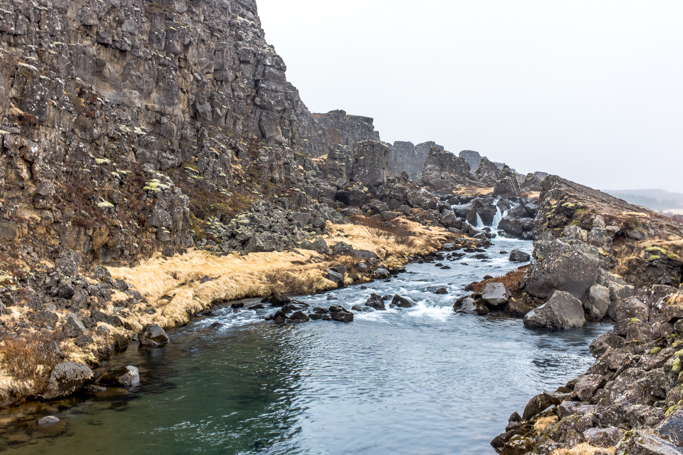
Locate an element on the screen. foam is located at coordinates (429, 307).